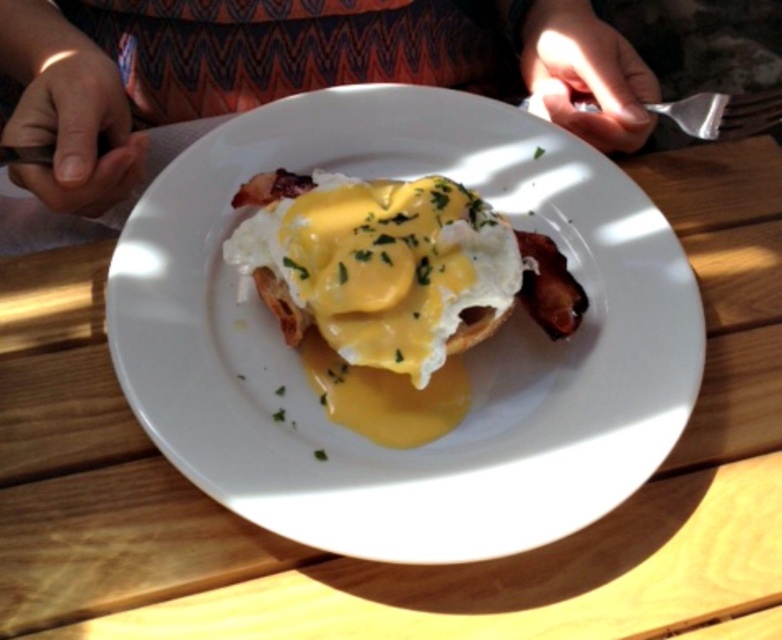
You are a chef arranging a plate for a photo shoot. You have a white creamy egg at center and a patterned fabric shirt at center on the table. Which item should you move to avoid overlapping?

The white creamy egg at center is wider than the patterned fabric shirt at center, so you should move the patterned fabric shirt at center to avoid overlapping.

You are a chef holding a spoon that is 6 inches long. You want to reach the white creamy egg at center from your current position. Can you reach it with your spoon without moving your hand?

The white creamy egg at center and viewer are 15.41 inches apart. Since your spoon is only 6 inches long, you cannot reach the egg without moving your hand.

You are a food critic analyzing the plate of Eggs Benedict. You notice two points on the plate, one at coordinates point (659, 442) and another at point (431, 323). Which of these points is closer to you as you look at the plate?

Point (659, 442) is closer to the viewer than point (431, 323).